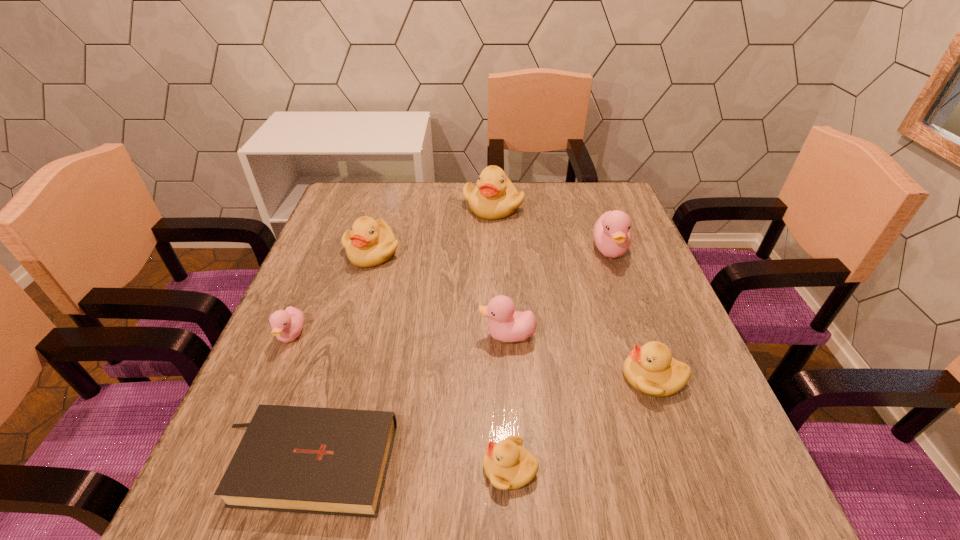
Identify the location of Bible that is at the near edge. (330, 461).

At what (x,y) coordinates should I click in order to perform the action: click on Bible that is at the left edge. Please return your answer as a coordinate pair (x, y). Looking at the image, I should click on (330, 461).

Locate an element on the screen. object located in the near left corner section of the desktop is located at coordinates (330, 461).

The width and height of the screenshot is (960, 540). In the image, there is a desktop. Identify the location of free region at the near edge. (502, 498).

The height and width of the screenshot is (540, 960). In the image, there is a desktop. What are the coordinates of `vacant space at the left edge` in the screenshot? It's located at (307, 264).

Locate an element on the screen. The image size is (960, 540). blank space at the right edge of the desktop is located at coordinates [x=654, y=434].

Where is `vacant region at the far left corner`? vacant region at the far left corner is located at coordinates (354, 197).

Where is `vacant space at the near left corner of the desktop`? This screenshot has width=960, height=540. vacant space at the near left corner of the desktop is located at coordinates (226, 522).

Identify the location of free space at the far right corner of the desktop. (610, 185).

Identify the location of vacant space at the near right corner. This screenshot has height=540, width=960. (718, 500).